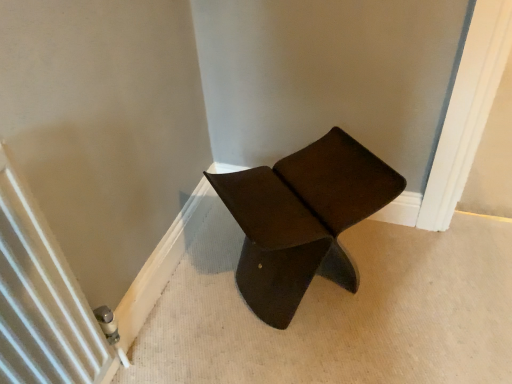
The width and height of the screenshot is (512, 384). I want to click on vacant space positioned to the left of brown leather stool at center, so click(x=199, y=294).